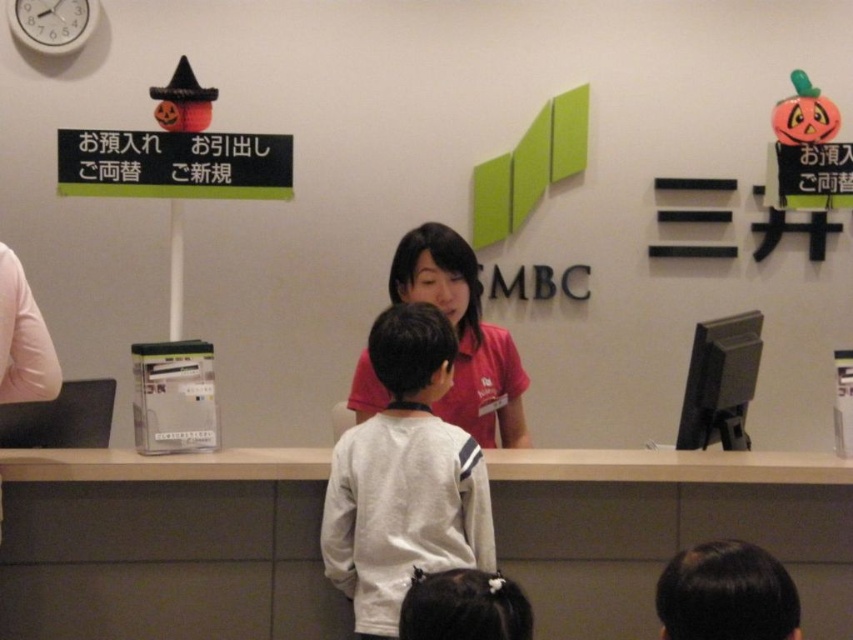
Does white fleece jacket at center appear on the right side of white plastic clock at upper left?

Indeed, white fleece jacket at center is positioned on the right side of white plastic clock at upper left.

Between white fleece jacket at center and white plastic clock at upper left, which one appears on the right side from the viewer's perspective?

Positioned to the right is white fleece jacket at center.

The width and height of the screenshot is (853, 640). What do you see at coordinates (404, 477) in the screenshot?
I see `white fleece jacket at center` at bounding box center [404, 477].

This screenshot has height=640, width=853. I want to click on white fleece jacket at center, so click(x=404, y=477).

Which is in front, point (509, 372) or point (93, 4)?

Point (509, 372) is in front.

Does red matte shirt at center have a greater height compared to white plastic clock at upper left?

Indeed, red matte shirt at center has a greater height compared to white plastic clock at upper left.

Is point (398, 301) positioned in front of point (53, 36)?

Yes, point (398, 301) is closer to viewer.

I want to click on red matte shirt at center, so click(463, 333).

From the picture: Does white fleece jacket at center appear on the left side of red matte shirt at center?

Indeed, white fleece jacket at center is positioned on the left side of red matte shirt at center.

From the picture: Which of these two, white fleece jacket at center or red matte shirt at center, stands shorter?

red matte shirt at center

Which is in front, point (339, 512) or point (479, 400)?

Point (339, 512)

The width and height of the screenshot is (853, 640). Identify the location of white fleece jacket at center. (404, 477).